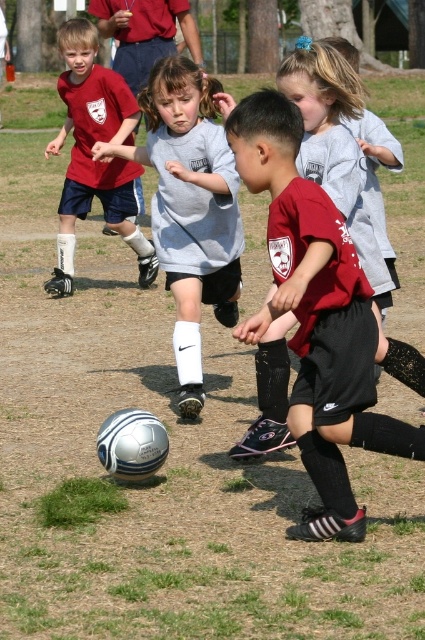
Is point (82, 124) farther from camera compared to point (311, 93)?

Yes, point (82, 124) is farther from viewer.

Is matte red shirt at left above gray cotton shirt at upper center?

Indeed, matte red shirt at left is positioned over gray cotton shirt at upper center.

Who is more forward, (107,118) or (297,52)?

Point (297,52) is in front.

I want to click on matte red shirt at left, so (90, 154).

Does matte red shirt at center have a smaller size compared to white matte soccer ball at center?

Yes, matte red shirt at center is smaller than white matte soccer ball at center.

Is matte red shirt at center to the right of white matte soccer ball at center from the viewer's perspective?

Indeed, matte red shirt at center is positioned on the right side of white matte soccer ball at center.

Between point (229, 116) and point (226, 212), which one is positioned behind?

Point (226, 212)

I want to click on matte red shirt at center, so click(x=316, y=316).

Between white matte soccer ball at center and gray cotton shirt at upper center, which one appears on the right side from the viewer's perspective?

From the viewer's perspective, gray cotton shirt at upper center appears more on the right side.

Between point (149, 112) and point (280, 355), which one is positioned behind?

Positioned behind is point (149, 112).

Does point (189, 388) come in front of point (322, 72)?

No.

Image resolution: width=425 pixels, height=640 pixels. In order to click on white matte soccer ball at center in this screenshot , I will do `click(189, 209)`.